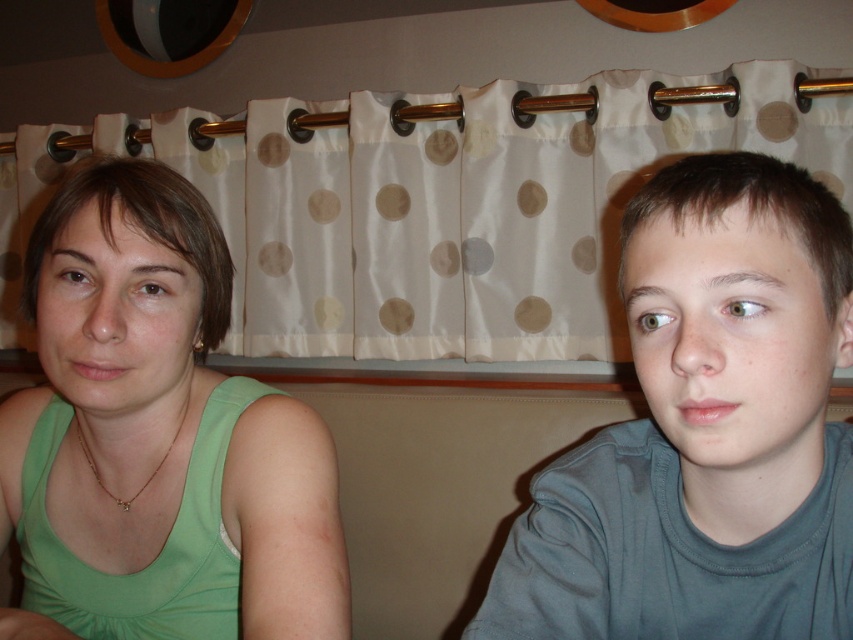
Question: Is gray cotton shirt at right behind green fabric tank top at left?

Choices:
 (A) no
 (B) yes

Answer: (A)

Question: Which point is farther to the camera?

Choices:
 (A) white polka dot fabric at upper center
 (B) green fabric tank top at left
 (C) gray cotton shirt at right

Answer: (A)

Question: Does white polka dot fabric at upper center appear on the left side of gray cotton shirt at right?

Choices:
 (A) no
 (B) yes

Answer: (B)

Question: Which of the following is the closest to the observer?

Choices:
 (A) (814, 221)
 (B) (294, 250)
 (C) (157, 260)

Answer: (A)

Question: Is gray cotton shirt at right to the left of green fabric tank top at left from the viewer's perspective?

Choices:
 (A) no
 (B) yes

Answer: (A)

Question: Which point is farther to the camera?

Choices:
 (A) white polka dot fabric at upper center
 (B) gray cotton shirt at right

Answer: (A)